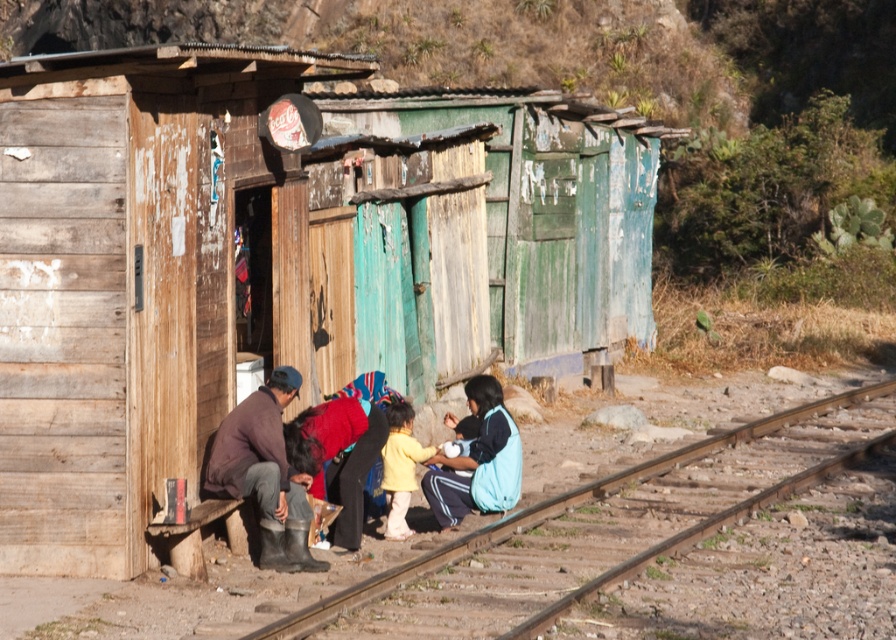
Is the position of brown leather jacket at lower center less distant than that of blue fleece jacket at lower right?

Yes, it is in front of blue fleece jacket at lower right.

Does brown leather jacket at lower center have a greater height compared to blue fleece jacket at lower right?

Yes.

Where is `brown leather jacket at lower center`? This screenshot has width=896, height=640. brown leather jacket at lower center is located at coordinates (285, 460).

Is point (530, 200) closer to camera compared to point (395, 157)?

No.

At what (x,y) coordinates should I click in order to perform the action: click on weathered wood hut at center. Please return your answer as a coordinate pair (x, y). The width and height of the screenshot is (896, 640). Looking at the image, I should click on (278, 260).

Can you confirm if brown leather jacket at lower center is positioned to the right of brown leather jacket at left?

Indeed, brown leather jacket at lower center is positioned on the right side of brown leather jacket at left.

Is brown leather jacket at lower center to the left of brown leather jacket at left from the viewer's perspective?

No, brown leather jacket at lower center is not to the left of brown leather jacket at left.

Describe the element at coordinates (285, 460) in the screenshot. This screenshot has width=896, height=640. I see `brown leather jacket at lower center` at that location.

Locate an element on the screen. This screenshot has height=640, width=896. brown leather jacket at lower center is located at coordinates (285, 460).